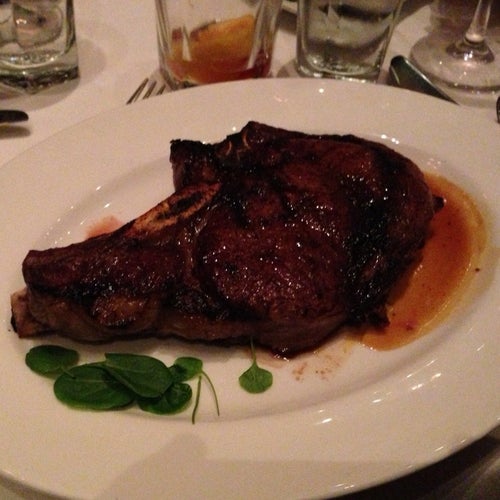
At what (x,y) coordinates should I click in order to perform the action: click on wine glass. Please return your answer as a coordinate pair (x, y). Looking at the image, I should click on (448, 54).